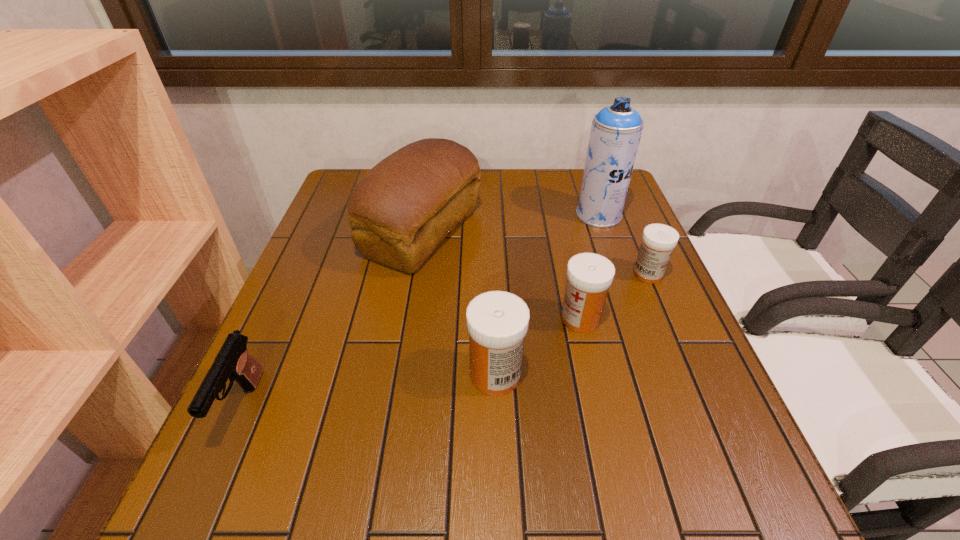
Find the location of a particular element. medicine that is the second closest to the pistol is located at coordinates (589, 276).

You are a GUI agent. You are given a task and a screenshot of the screen. Output one action in this format:
    pyautogui.click(x=<x>, y=<y>)
    Task: Click on the free space that satisfies the following two spatial constraints: 1. on the front side of the second tallest object; 2. on the left side of the fourth object from left to right
    The image size is (960, 540).
    Given the screenshot: What is the action you would take?
    pyautogui.click(x=409, y=319)

Find the location of a particular element. The image size is (960, 540). vacant space that satisfies the following two spatial constraints: 1. on the back side of the bread; 2. on the right side of the tallest object is located at coordinates (425, 215).